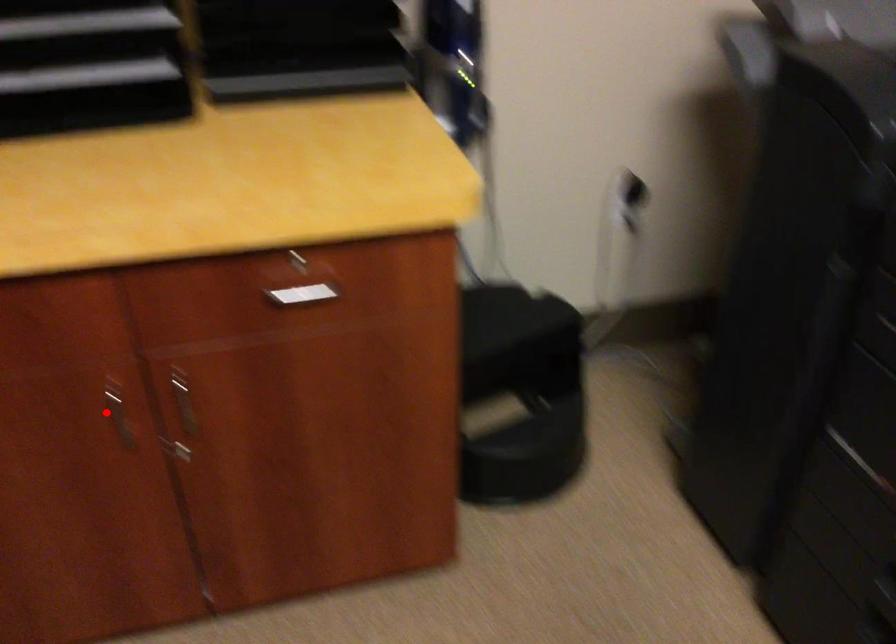
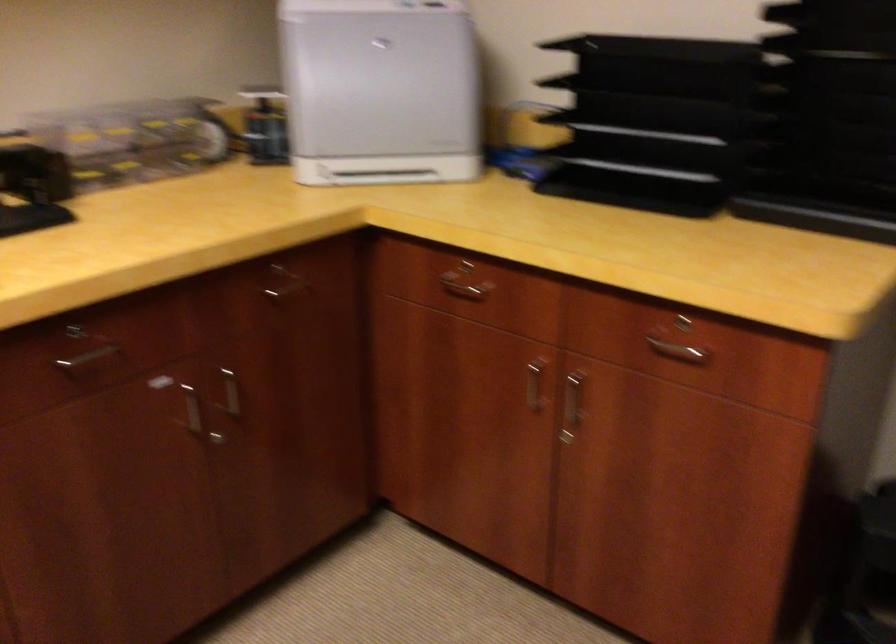
Question: I am providing you with two images of the same scene from different viewpoints. In image1, a red point is highlighted. Considering the same 3D point in image2, which of the following is correct?

Choices:
 (A) It is closer
 (B) It is farther

Answer: (B)